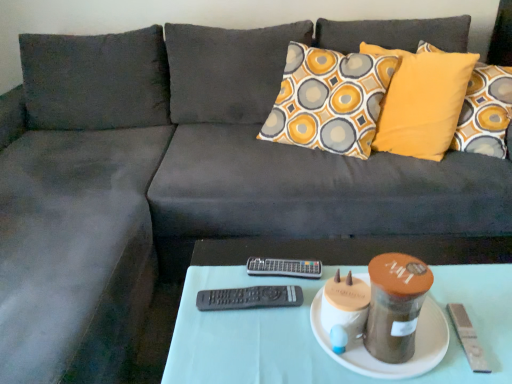
Question: Can you confirm if black plastic remote at center, the 1th remote when ordered from front to back, is positioned to the right of white fabric table at center?

Choices:
 (A) yes
 (B) no

Answer: (B)

Question: Considering the relative sizes of black plastic remote at center, the second remote when ordered from back to front, and white fabric table at center in the image provided, is black plastic remote at center, the second remote when ordered from back to front, shorter than white fabric table at center?

Choices:
 (A) yes
 (B) no

Answer: (A)

Question: Does black plastic remote at center, the 1th remote when ordered from bottom to top, appear on the left side of white fabric table at center?

Choices:
 (A) no
 (B) yes

Answer: (B)

Question: Is the depth of black plastic remote at center, the second remote when ordered from back to front, greater than that of white fabric table at center?

Choices:
 (A) yes
 (B) no

Answer: (A)

Question: Are black plastic remote at center, marked as the 2th remote in a top-to-bottom arrangement, and white fabric table at center located far from each other?

Choices:
 (A) yes
 (B) no

Answer: (B)

Question: Considering the relative positions of black plastic remote at center, the second remote when ordered from back to front, and white ceramic plate at center in the image provided, is black plastic remote at center, the second remote when ordered from back to front, to the left or to the right of white ceramic plate at center?

Choices:
 (A) right
 (B) left

Answer: (B)

Question: Is point (238, 304) closer or farther from the camera than point (375, 377)?

Choices:
 (A) closer
 (B) farther

Answer: (B)

Question: Choose the correct answer: Is black plastic remote at center, the second remote when ordered from back to front, inside white ceramic plate at center or outside it?

Choices:
 (A) outside
 (B) inside

Answer: (A)

Question: Relative to white ceramic plate at center, is black plastic remote at center, marked as the 2th remote in a top-to-bottom arrangement, in front or behind?

Choices:
 (A) behind
 (B) front

Answer: (A)

Question: Is white ceramic plate at center taller or shorter than black plastic remote at center, positioned as the first remote in top-to-bottom order?

Choices:
 (A) tall
 (B) short

Answer: (A)

Question: In terms of width, does white ceramic plate at center look wider or thinner when compared to black plastic remote at center, placed as the first remote when sorted from back to front?

Choices:
 (A) thin
 (B) wide

Answer: (B)

Question: Is point (435, 321) positioned closer to the camera than point (266, 259)?

Choices:
 (A) closer
 (B) farther

Answer: (A)

Question: In the image, is white ceramic plate at center positioned in front of or behind black plastic remote at center, marked as the second remote in a bottom-to-top arrangement?

Choices:
 (A) front
 (B) behind

Answer: (A)

Question: From the image's perspective, is white ceramic plate at center above or below black plastic remote at center, marked as the 2th remote in a top-to-bottom arrangement?

Choices:
 (A) above
 (B) below

Answer: (B)

Question: Considering the positions of white ceramic plate at center and black plastic remote at center, the 1th remote when ordered from bottom to top, in the image, is white ceramic plate at center bigger or smaller than black plastic remote at center, the 1th remote when ordered from bottom to top,?

Choices:
 (A) small
 (B) big

Answer: (B)